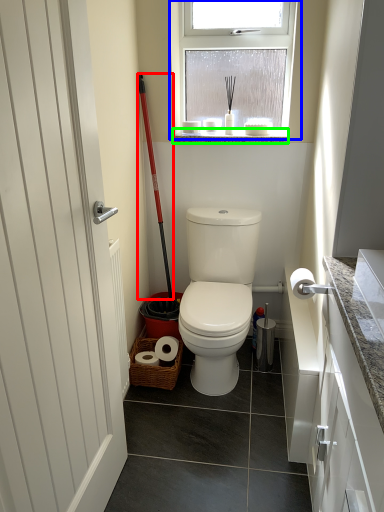
Question: Which is farther away from shovel (highlighted by a red box)? window (highlighted by a blue box) or window sill (highlighted by a green box)?

Choices:
 (A) window
 (B) window sill

Answer: (A)